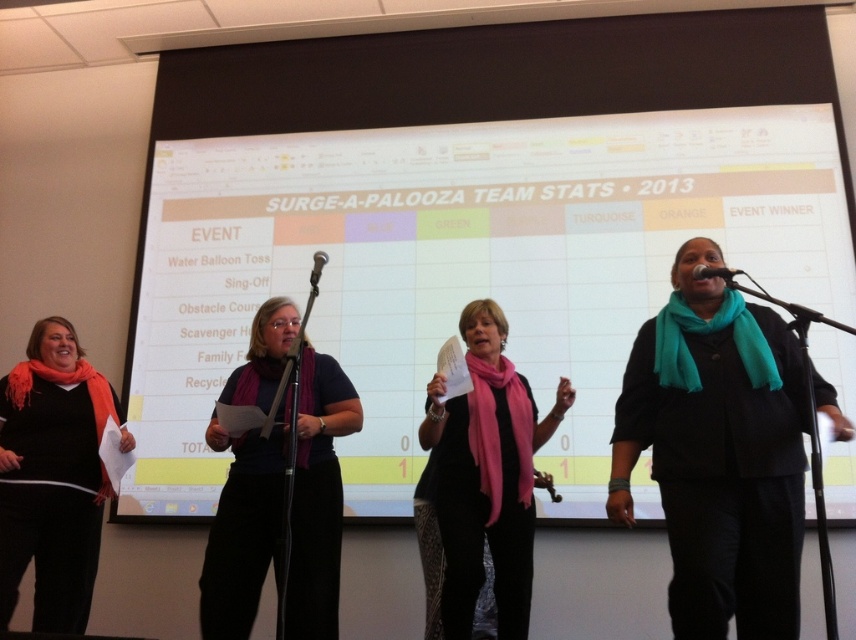
Question: Among these objects, which one is nearest to the camera?

Choices:
 (A) purple scarf at center
 (B) white paper at center

Answer: (A)

Question: Where is purple scarf at center located in relation to metallic silver microphone at right in the image?

Choices:
 (A) below
 (B) above

Answer: (A)

Question: Does purple scarf at center have a lesser width compared to orange scarf at left?

Choices:
 (A) no
 (B) yes

Answer: (A)

Question: Considering the real-world distances, which object is farthest from the pink scarf at center?

Choices:
 (A) white paper at center
 (B) metallic silver microphone at center
 (C) purple scarf at center

Answer: (B)

Question: Based on their relative distances, which object is nearer to the pink scarf at center?

Choices:
 (A) orange scarf at left
 (B) teal scarf at center
 (C) white paper at center
 (D) metallic silver microphone at right

Answer: (B)

Question: Is white paper at center behind purple scarf at center?

Choices:
 (A) no
 (B) yes

Answer: (B)